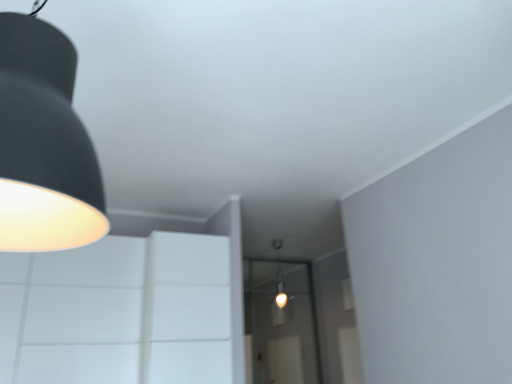
Question: Is point (281, 324) closer or farther from the camera than point (48, 130)?

Choices:
 (A) closer
 (B) farther

Answer: (B)

Question: Considering the positions of transparent glass door at center and matte black lampshade at upper left in the image, is transparent glass door at center bigger or smaller than matte black lampshade at upper left?

Choices:
 (A) big
 (B) small

Answer: (A)

Question: Visually, is transparent glass door at center positioned to the left or to the right of matte black lampshade at upper left?

Choices:
 (A) left
 (B) right

Answer: (B)

Question: From a real-world perspective, relative to transparent glass door at center, is matte black lampshade at upper left vertically above or below?

Choices:
 (A) above
 (B) below

Answer: (A)

Question: Considering the positions of point (37, 223) and point (291, 369), is point (37, 223) closer or farther from the camera than point (291, 369)?

Choices:
 (A) farther
 (B) closer

Answer: (B)

Question: In the image, is matte black lampshade at upper left positioned in front of or behind transparent glass door at center?

Choices:
 (A) front
 (B) behind

Answer: (A)

Question: Is matte black lampshade at upper left inside or outside of transparent glass door at center?

Choices:
 (A) outside
 (B) inside

Answer: (A)